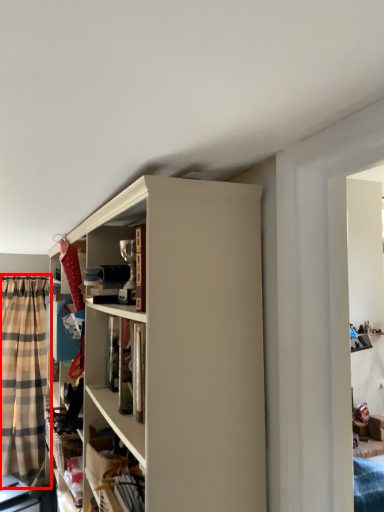
Question: From the image's perspective, what is the correct spatial relationship of curtain (annotated by the red box) in relation to cabinet?

Choices:
 (A) below
 (B) above

Answer: (A)